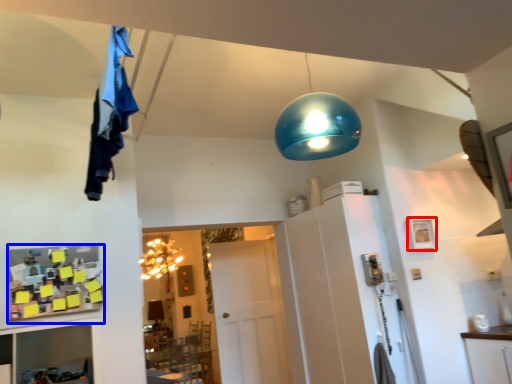
Question: Which of the following is the farthest to the observer, picture frame (highlighted by a red box) or shelf (highlighted by a blue box)?

Choices:
 (A) picture frame
 (B) shelf

Answer: (A)